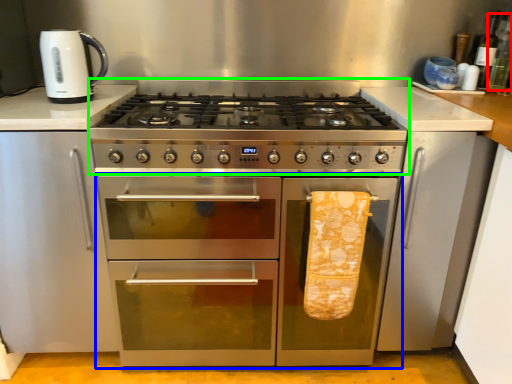
Question: Estimate the real-world distances between objects in this image. Which object is farther from bottle (highlighted by a red box), oven (highlighted by a blue box) or gas stove (highlighted by a green box)?

Choices:
 (A) oven
 (B) gas stove

Answer: (A)